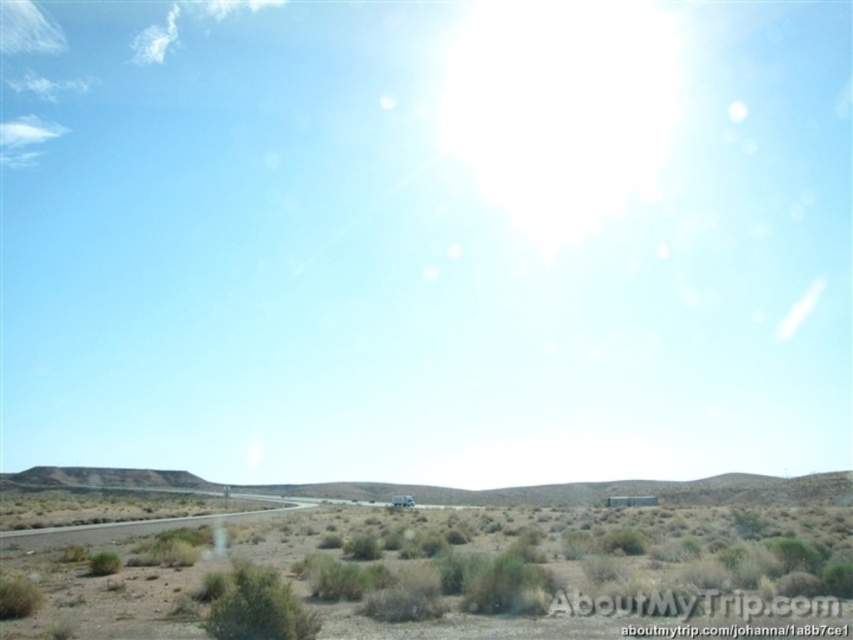
Question: Among these points, which one is nearest to the camera?

Choices:
 (A) click(x=398, y=500)
 (B) click(x=225, y=541)
 (C) click(x=265, y=509)

Answer: (B)

Question: Is brown dry grass at lower center bigger than white matte truck at center?

Choices:
 (A) no
 (B) yes

Answer: (B)

Question: Estimate the real-world distances between objects in this image. Which object is farther from the brown dry grass at lower center?

Choices:
 (A) gray asphalt highway at lower left
 (B) white matte truck at center

Answer: (B)

Question: Can you confirm if gray asphalt highway at lower left is positioned below white matte truck at center?

Choices:
 (A) no
 (B) yes

Answer: (A)

Question: Among these points, which one is farthest from the camera?

Choices:
 (A) pos(401,502)
 (B) pos(19,545)
 (C) pos(12,512)

Answer: (A)

Question: Is gray asphalt highway at lower left closer to the viewer compared to white matte truck at center?

Choices:
 (A) yes
 (B) no

Answer: (A)